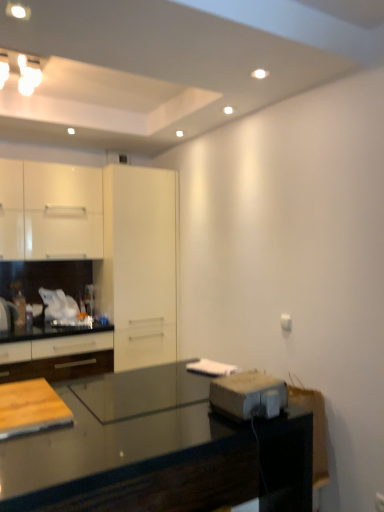
Question: Considering the relative positions of white glossy cabinets at left, the 1th cabinetry when ordered from bottom to top, and metallic gray toaster at lower right in the image provided, is white glossy cabinets at left, the 1th cabinetry when ordered from bottom to top, to the left or to the right of metallic gray toaster at lower right?

Choices:
 (A) left
 (B) right

Answer: (A)

Question: Considering the positions of point (117, 262) and point (259, 415), is point (117, 262) closer or farther from the camera than point (259, 415)?

Choices:
 (A) farther
 (B) closer

Answer: (A)

Question: Which object is the closest to the transparent glass cabinet at center?

Choices:
 (A) white glossy cabinets at left, the 1th cabinetry when ordered from bottom to top
 (B) wooden cutting board at lower left
 (C) white glossy cabinet at upper left, acting as the second cabinetry starting from the bottom
 (D) black glossy countertop at lower center
 (E) metallic gray toaster at lower right

Answer: (A)

Question: Estimate the real-world distances between objects in this image. Which object is closer to the transparent glass cabinet at center?

Choices:
 (A) metallic gray toaster at lower right
 (B) black glossy countertop at lower center
 (C) white glossy cabinet at upper left, arranged as the 1th cabinetry when viewed from the top
 (D) wooden cutting board at lower left
 (E) white glossy cabinets at left, the 1th cabinetry when ordered from bottom to top

Answer: (E)